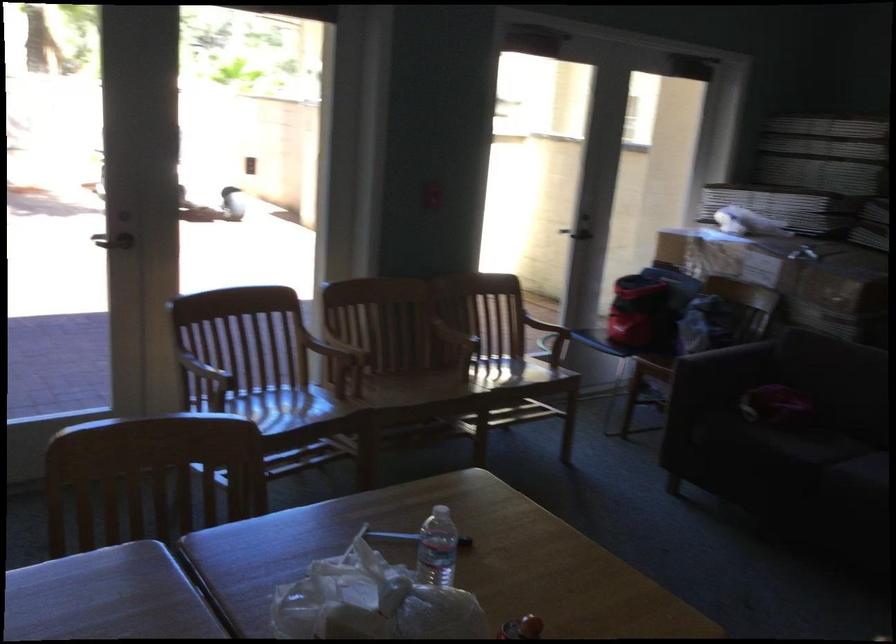
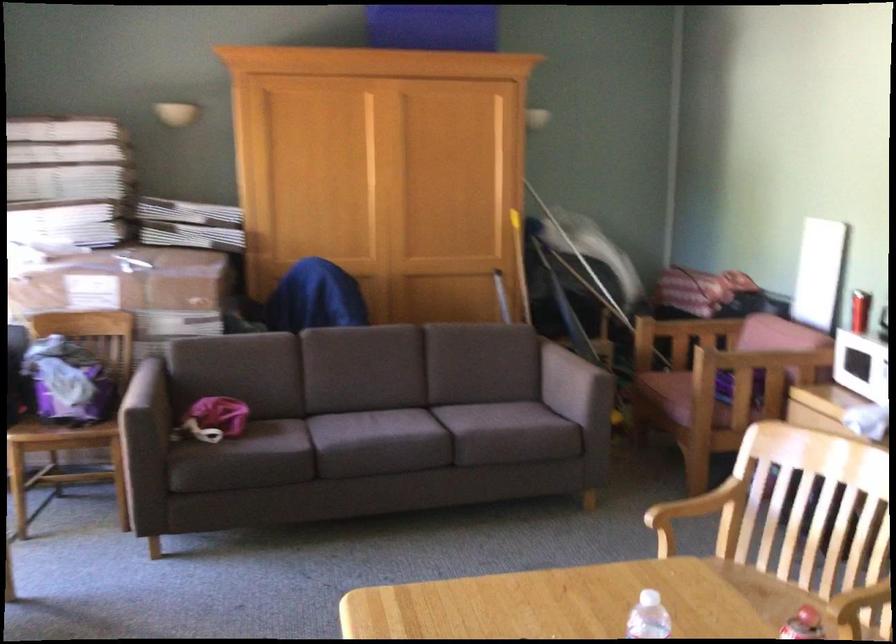
The point at (745,345) is marked in the first image. Where is the corresponding point in the second image?

(144, 386)